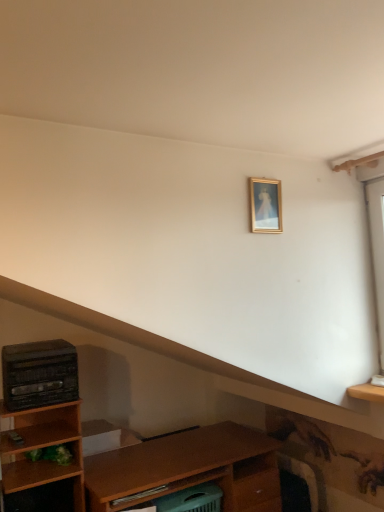
Describe the element at coordinates (266, 205) in the screenshot. I see `gold-framed picture at upper center` at that location.

Identify the location of gold-framed picture at upper center. (266, 205).

Measure the distance between point (46,366) and camera.

A distance of 2.21 meters exists between point (46,366) and camera.

The image size is (384, 512). In order to click on black plastic stereo at left in this screenshot , I will do `click(39, 374)`.

In order to face black plastic stereo at left, should I rotate leftwards or rightwards?

A 19.871 degree turn to the left will do.

Measure the distance between black plastic stereo at left and camera.

2.17 meters.

What do you see at coordinates (39, 374) in the screenshot? I see `black plastic stereo at left` at bounding box center [39, 374].

Image resolution: width=384 pixels, height=512 pixels. Identify the location of gold-framed picture at upper center. (266, 205).

Which object is positioned more to the left, black plastic stereo at left or gold-framed picture at upper center?

black plastic stereo at left is more to the left.

Is black plastic stereo at left behind gold-framed picture at upper center?

That is True.

Does point (49, 365) appear closer or farther from the camera than point (270, 221)?

Point (49, 365) appears to be farther away from the viewer than point (270, 221).

From the image's perspective, is black plastic stereo at left beneath gold-framed picture at upper center?

Yes, from the image's perspective, black plastic stereo at left is below gold-framed picture at upper center.

From a real-world perspective, which object rests below the other?

From a 3D spatial view, black plastic stereo at left is below.

Considering the sizes of black plastic stereo at left and gold-framed picture at upper center in the image, is black plastic stereo at left wider or thinner than gold-framed picture at upper center?

Considering their sizes, black plastic stereo at left looks broader than gold-framed picture at upper center.

Considering the sizes of objects black plastic stereo at left and gold-framed picture at upper center in the image provided, who is shorter, black plastic stereo at left or gold-framed picture at upper center?

With less height is gold-framed picture at upper center.

Is black plastic stereo at left smaller than gold-framed picture at upper center?

No.

Could gold-framed picture at upper center be considered to be inside black plastic stereo at left?

No.

Does black plastic stereo at left touch gold-framed picture at upper center?

No, black plastic stereo at left is not beside gold-framed picture at upper center.

Is black plastic stereo at left oriented away from gold-framed picture at upper center?

No, black plastic stereo at left's orientation is not away from gold-framed picture at upper center.

How different are the orientations of black plastic stereo at left and gold-framed picture at upper center in degrees?

They differ by 1.59 degrees in their facing directions.

Find the location of `picture frame lying in front of the black plastic stereo at left`. picture frame lying in front of the black plastic stereo at left is located at coordinates (266, 205).

Would you say gold-framed picture at upper center is to the left or to the right of black plastic stereo at left in the picture?

Based on their positions, gold-framed picture at upper center is located to the right of black plastic stereo at left.

Which object is more forward, gold-framed picture at upper center or black plastic stereo at left?

Positioned in front is gold-framed picture at upper center.

Is point (259, 181) positioned behind point (67, 344)?

No, (259, 181) is in front of (67, 344).

From the image's perspective, which object appears higher, gold-framed picture at upper center or black plastic stereo at left?

gold-framed picture at upper center is shown above in the image.

From a real-world perspective, who is located lower, gold-framed picture at upper center or black plastic stereo at left?

black plastic stereo at left, from a real-world perspective.

Is gold-framed picture at upper center thinner than black plastic stereo at left?

Yes.

Considering the sizes of objects gold-framed picture at upper center and black plastic stereo at left in the image provided, who is taller, gold-framed picture at upper center or black plastic stereo at left?

Standing taller between the two is black plastic stereo at left.

Which of these two, gold-framed picture at upper center or black plastic stereo at left, is smaller?

gold-framed picture at upper center.

Can we say gold-framed picture at upper center lies outside black plastic stereo at left?

Yes, gold-framed picture at upper center is located beyond the bounds of black plastic stereo at left.

Based on the photo, is gold-framed picture at upper center beside black plastic stereo at left?

No.

Is gold-framed picture at upper center turned away from black plastic stereo at left?

No, black plastic stereo at left is not at the back of gold-framed picture at upper center.

The width and height of the screenshot is (384, 512). Identify the location of picture frame on the right of black plastic stereo at left. (266, 205).

Image resolution: width=384 pixels, height=512 pixels. Find the location of `appliance located below the gold-framed picture at upper center (from the image's perspective)`. appliance located below the gold-framed picture at upper center (from the image's perspective) is located at coordinates (39, 374).

I want to click on picture frame that appears on the right of black plastic stereo at left, so (266, 205).